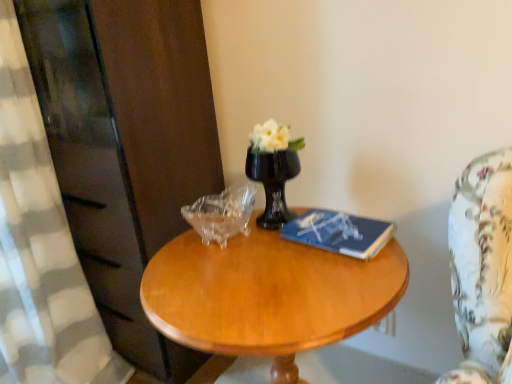
Identify the location of empty space that is ontop of blue matte book at center (from a real-world perspective). [328, 221].